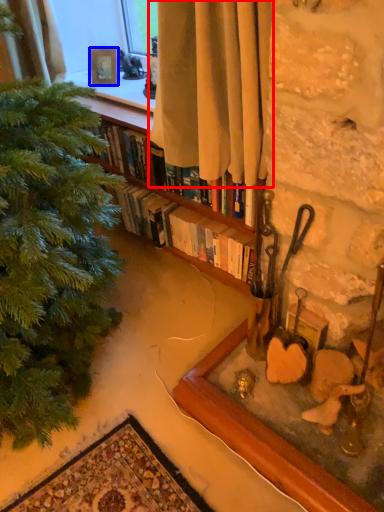
Question: Which object appears farthest to the camera in this image, curtain (highlighted by a red box) or picture frame (highlighted by a blue box)?

Choices:
 (A) curtain
 (B) picture frame

Answer: (B)